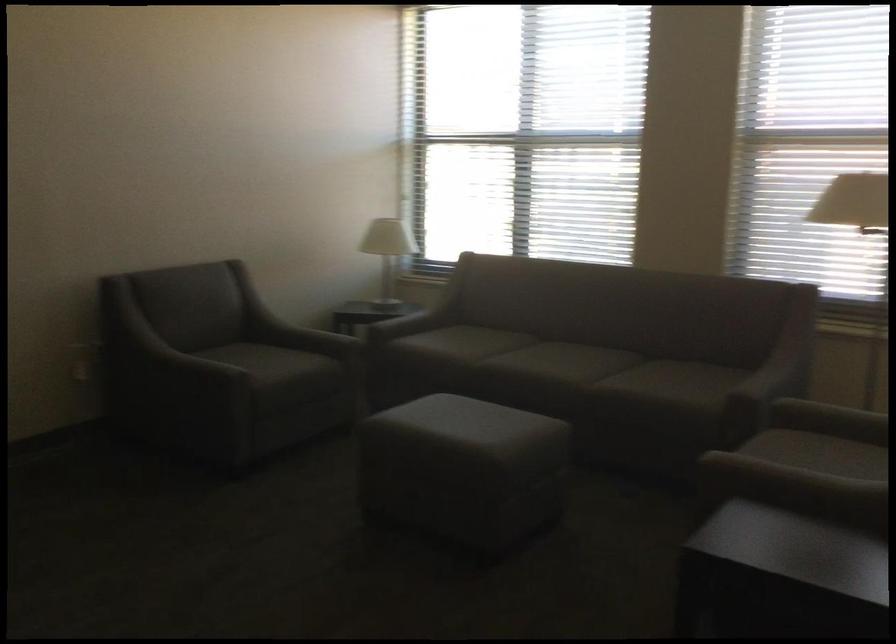
Locate an element on the screen. sofa sitting surface is located at coordinates (580, 373).